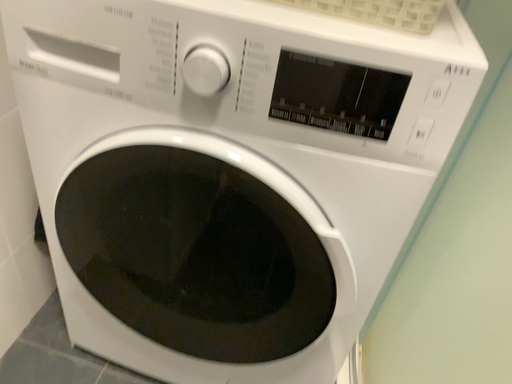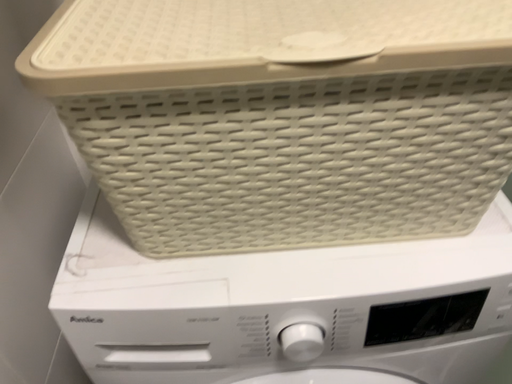
Question: Which way did the camera rotate in the video?

Choices:
 (A) rotated right
 (B) rotated left

Answer: (A)